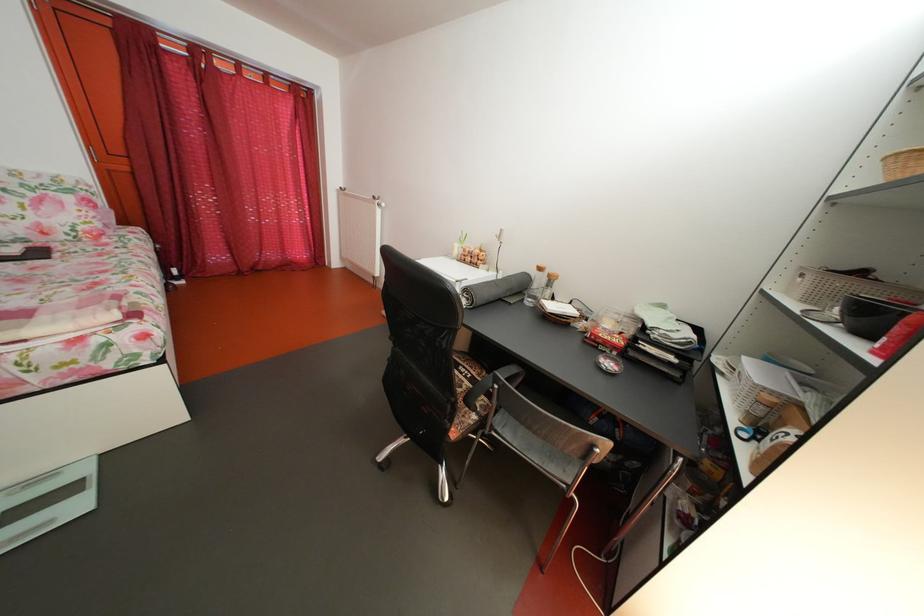
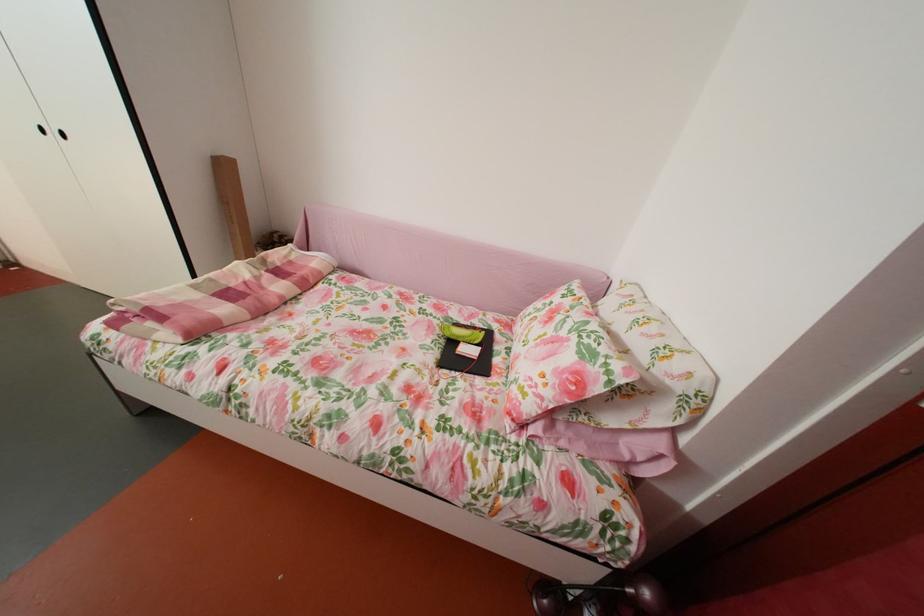
Where in the second image is the point corresponding to point 110,231 from the first image?

(541, 413)